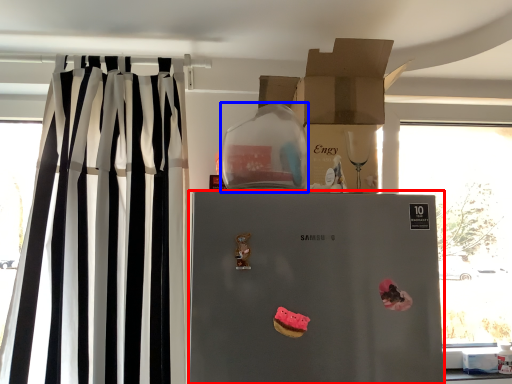
Question: Among these objects, which one is nearest to the camera, refrigerator (highlighted by a red box) or appliance (highlighted by a blue box)?

Choices:
 (A) refrigerator
 (B) appliance

Answer: (A)